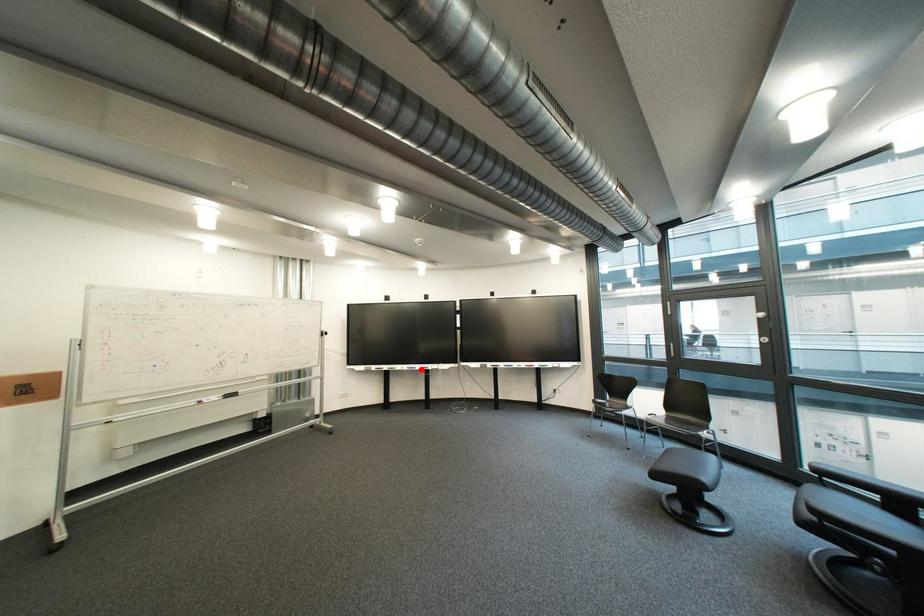
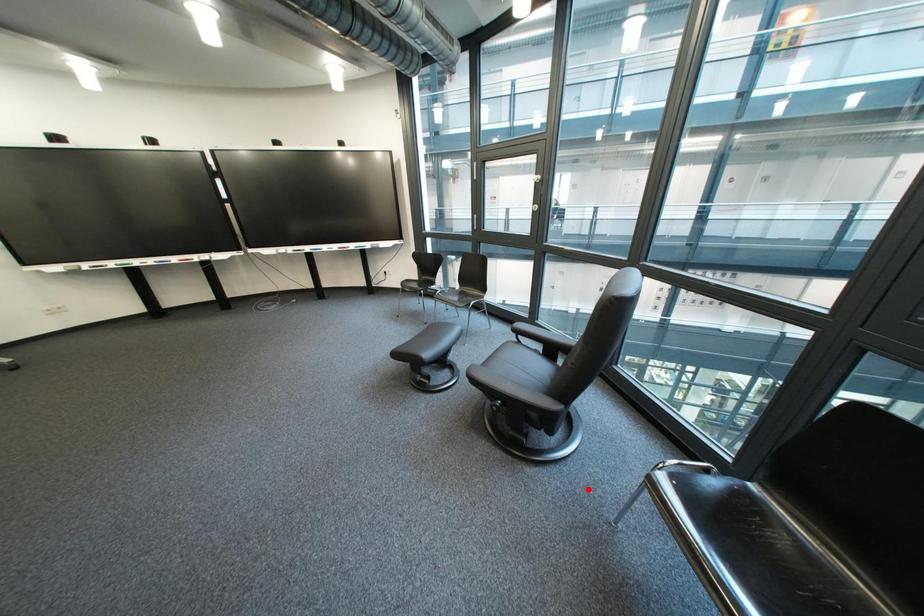
Looking at this image, I am providing you with two images of the same scene from different viewpoints. A red point is marked on the first image and another point is marked on the second image. Is the marked point in image1 the same physical position as the marked point in image2?

No